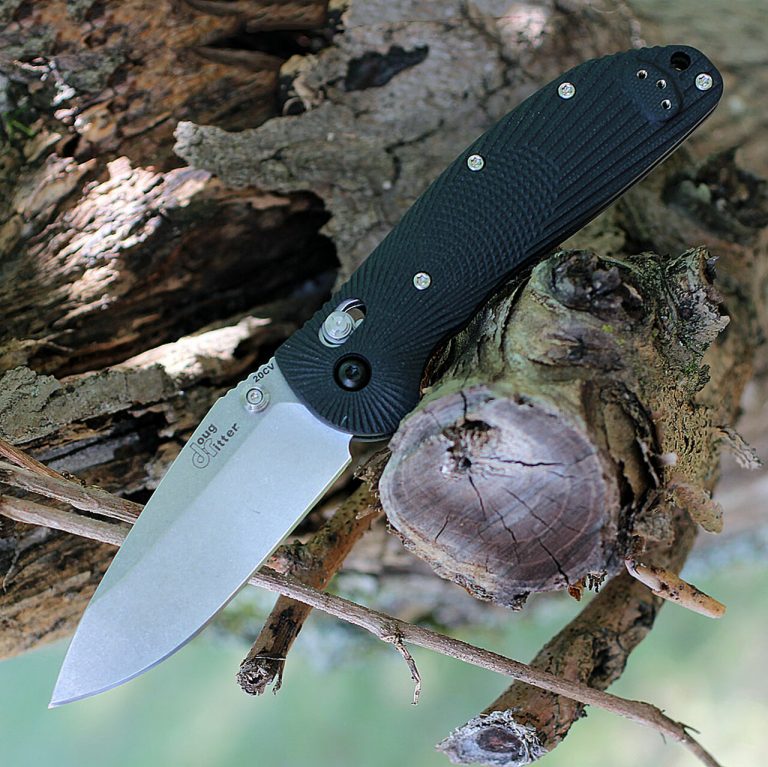
I want to click on screws, so click(472, 157), click(424, 281), click(336, 326), click(255, 396), click(351, 373), click(700, 83).